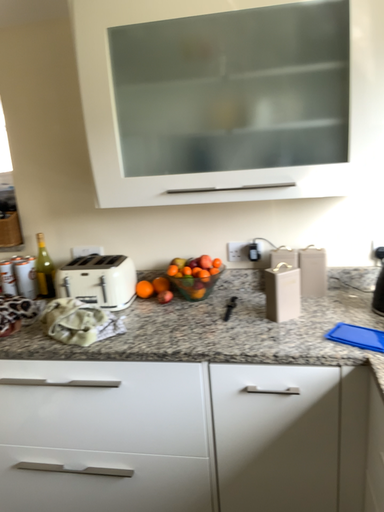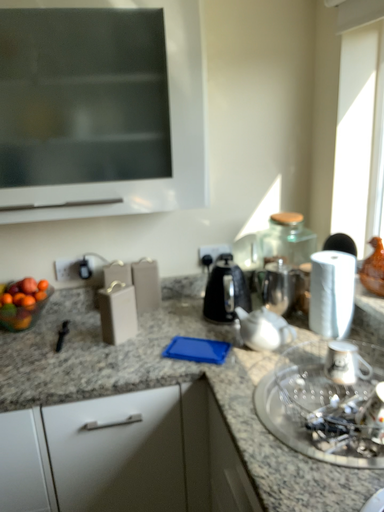
Question: Which way did the camera rotate in the video?

Choices:
 (A) rotated left
 (B) rotated right

Answer: (B)